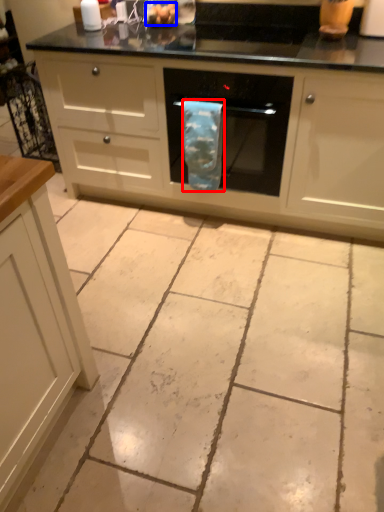
Question: Which object is further to the camera taking this photo, material (highlighted by a red box) or food (highlighted by a blue box)?

Choices:
 (A) material
 (B) food

Answer: (B)